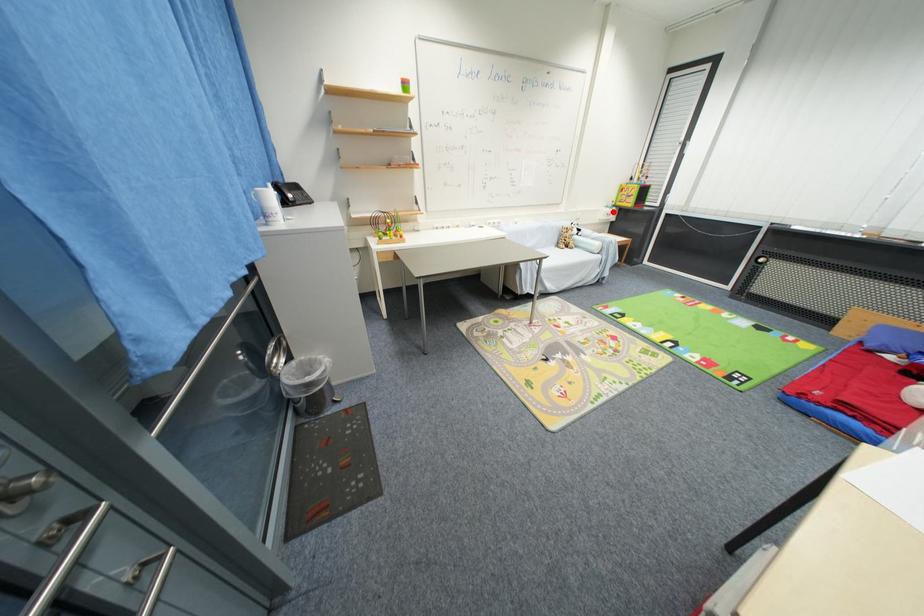
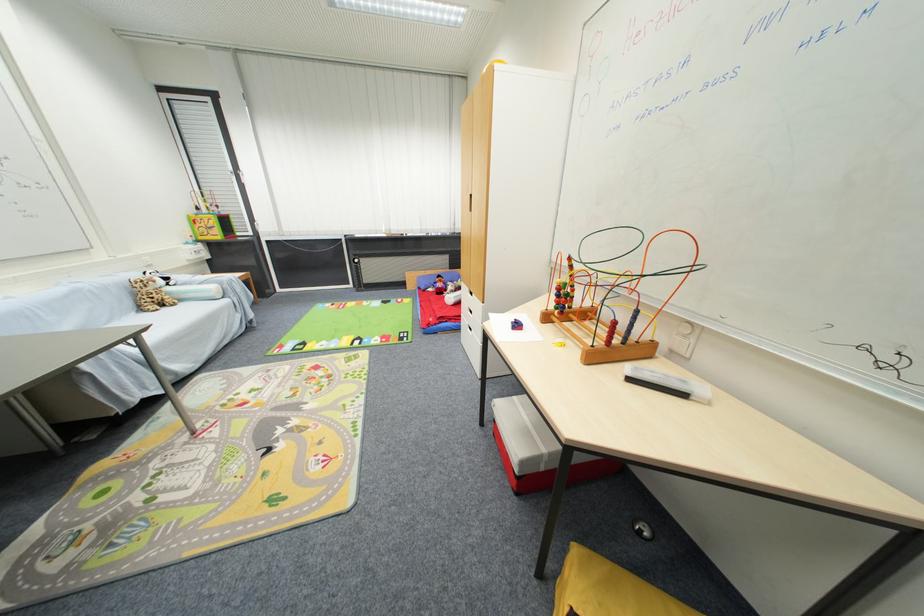
Question: I am providing you with two images of the same scene from different viewpoints. A red point is shown in image1. For the corresponding object point in image2, is it positioned nearer or farther from the camera?

Choices:
 (A) Nearer
 (B) Farther

Answer: (B)